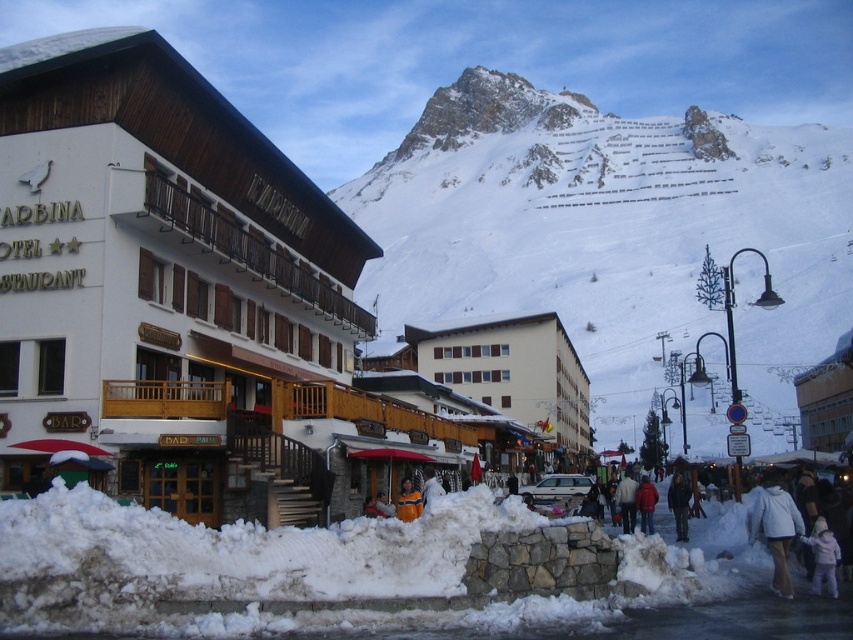
Can you confirm if snowy rock at upper center is wider than white wool coat at center?

Yes, snowy rock at upper center is wider than white wool coat at center.

The width and height of the screenshot is (853, 640). I want to click on snowy rock at upper center, so click(612, 232).

Who is taller, white fleece jacket at lower right or white wool coat at center?

white wool coat at center

Can you confirm if white fleece jacket at lower right is shorter than white wool coat at center?

Yes.

Is point (773, 561) positioned behind point (630, 500)?

No.

This screenshot has width=853, height=640. Identify the location of white fleece jacket at lower right. (775, 529).

Does white fleece jacket at lower right appear on the left side of red woolen jacket at lower right?

Incorrect, white fleece jacket at lower right is not on the left side of red woolen jacket at lower right.

Based on the photo, does white fleece jacket at lower right appear on the right side of red woolen jacket at lower right?

Yes, white fleece jacket at lower right is to the right of red woolen jacket at lower right.

Is point (764, 502) farther from viewer compared to point (650, 493)?

That is False.

This screenshot has width=853, height=640. I want to click on white fleece jacket at lower right, so click(775, 529).